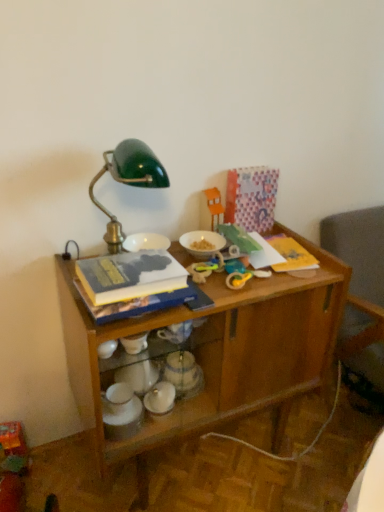
Identify the location of orange plastic toy at upper center, the 1th toy in the top-to-bottom sequence. The width and height of the screenshot is (384, 512). (214, 207).

What do you see at coordinates (202, 243) in the screenshot? I see `white matte bowl at center, the 3th tableware from the bottom` at bounding box center [202, 243].

Identify the location of white glossy bowls at lower center, the first tableware viewed from the left. (121, 412).

Is wooden desk at center far away from white matte bowl at center, the 3th tableware from the bottom?

No, there isn't a large distance between wooden desk at center and white matte bowl at center, the 3th tableware from the bottom.

In the scene shown: Between wooden desk at center and white matte bowl at center, the 3th tableware from the bottom, which one has smaller size?

Smaller between the two is white matte bowl at center, the 3th tableware from the bottom.

In the scene shown: How many degrees apart are the facing directions of wooden desk at center and white matte bowl at center, positioned as the first tableware in right-to-left order?

0.000897 degrees.

Is wooden desk at center wider or thinner than white matte bowl at center, the 3th tableware from the bottom?

In the image, wooden desk at center appears to be wider than white matte bowl at center, the 3th tableware from the bottom.

Locate an element on the screen. the 1st toy to the right of the hardcover book at center, starting your count from the anchor is located at coordinates (206, 268).

Is rubber yellow toy at center, which appears as the 2th toy when ordered from the bottom, turned away from hardcover book at center?

rubber yellow toy at center, which appears as the 2th toy when ordered from the bottom, is not turned away from hardcover book at center.

What's the angular difference between rubber yellow toy at center, which is the 2th toy from front to back, and hardcover book at center's facing directions?

They differ by 0.423 degrees in their facing directions.

Between rubber yellow toy at center, which appears as the 2th toy when ordered from the bottom, and hardcover book at center, which one has more height?

hardcover book at center is taller.

Considering the positions of objects rubber yellow toy at center, which is the 2th toy from front to back, and white matte bowl at center, the 3th tableware from the bottom, in the image provided, who is in front, rubber yellow toy at center, which is the 2th toy from front to back, or white matte bowl at center, the 3th tableware from the bottom,?

Positioned in front is rubber yellow toy at center, which is the 2th toy from front to back.

In the scene shown: Considering the relative sizes of rubber yellow toy at center, which is the 2th toy from front to back, and white matte bowl at center, the 3th tableware from the bottom, in the image provided, is rubber yellow toy at center, which is the 2th toy from front to back, taller than white matte bowl at center, the 3th tableware from the bottom,?

Indeed, rubber yellow toy at center, which is the 2th toy from front to back, has a greater height compared to white matte bowl at center, the 3th tableware from the bottom.

Is rubber yellow toy at center, acting as the second toy starting from the back, not within white matte bowl at center, marked as the third tableware in a left-to-right arrangement?

Yes.

From the image's perspective, would you say rubber yellow toy at center, acting as the second toy starting from the back, is shown under white matte bowl at center, marked as the third tableware in a left-to-right arrangement?

Indeed, from the image's perspective, rubber yellow toy at center, acting as the second toy starting from the back, is shown beneath white matte bowl at center, marked as the third tableware in a left-to-right arrangement.

Could you measure the distance between orange plastic toy at upper center, the 1th toy viewed from the back, and metallic silver teapot at center, placed as the 2th tableware when sorted from top to bottom?

They are 23.70 inches apart.

Between orange plastic toy at upper center, the 1th toy in the top-to-bottom sequence, and metallic silver teapot at center, placed as the 2th tableware when sorted from top to bottom, which one has smaller size?

With smaller size is metallic silver teapot at center, placed as the 2th tableware when sorted from top to bottom.

Between point (214, 197) and point (157, 385), which one is positioned in front?

The point (157, 385) is closer to the camera.

Considering the positions of objects orange plastic toy at upper center, the 1th toy in the top-to-bottom sequence, and metallic silver teapot at center, placed as the 2th tableware when sorted from top to bottom, in the image provided, who is more to the left, orange plastic toy at upper center, the 1th toy in the top-to-bottom sequence, or metallic silver teapot at center, placed as the 2th tableware when sorted from top to bottom,?

metallic silver teapot at center, placed as the 2th tableware when sorted from top to bottom, is more to the left.

You are a GUI agent. You are given a task and a screenshot of the screen. Output one action in this format:
    pyautogui.click(x=<x>, y=<y>)
    Task: Click on the toy in front of the rubber yellow toy at center, which appears as the 2th toy when ordered from the bottom
    
    Given the screenshot: What is the action you would take?
    pyautogui.click(x=241, y=274)

Is rubber yellow toy at center, which is the 2th toy from front to back, at the right side of yellow rubber toy at center, arranged as the 1th toy when viewed from the front?

No, rubber yellow toy at center, which is the 2th toy from front to back, is not to the right of yellow rubber toy at center, arranged as the 1th toy when viewed from the front.

Is rubber yellow toy at center, the second toy in the top-to-bottom sequence, wider than yellow rubber toy at center, the third toy in the top-to-bottom sequence?

Indeed, rubber yellow toy at center, the second toy in the top-to-bottom sequence, has a greater width compared to yellow rubber toy at center, the third toy in the top-to-bottom sequence.

Considering the sizes of rubber yellow toy at center, acting as the second toy starting from the back, and yellow rubber toy at center, which appears as the 1th toy when ordered from the bottom, in the image, is rubber yellow toy at center, acting as the second toy starting from the back, bigger or smaller than yellow rubber toy at center, which appears as the 1th toy when ordered from the bottom,?

In the image, rubber yellow toy at center, acting as the second toy starting from the back, appears to be larger than yellow rubber toy at center, which appears as the 1th toy when ordered from the bottom.

From the image's perspective, between yellow rubber toy at center, acting as the 3th toy starting from the back, and metallic silver teapot at center, which is the second tableware from bottom to top, who is located below?

metallic silver teapot at center, which is the second tableware from bottom to top, is shown below in the image.

Can you confirm if yellow rubber toy at center, acting as the 3th toy starting from the back, is taller than metallic silver teapot at center, which is the second tableware from bottom to top?

Incorrect, the height of yellow rubber toy at center, acting as the 3th toy starting from the back, is not larger of that of metallic silver teapot at center, which is the second tableware from bottom to top.

Can you confirm if yellow rubber toy at center, acting as the 3th toy starting from the back, is bigger than metallic silver teapot at center, placed as the 2th tableware when sorted from top to bottom?

No, yellow rubber toy at center, acting as the 3th toy starting from the back, is not bigger than metallic silver teapot at center, placed as the 2th tableware when sorted from top to bottom.

Is metallic silver teapot at center, which is the second tableware from bottom to top, located within yellow rubber toy at center, arranged as the 1th toy when viewed from the front?

No, metallic silver teapot at center, which is the second tableware from bottom to top, is not surrounded by yellow rubber toy at center, arranged as the 1th toy when viewed from the front.

From the image's perspective, is white glossy bowls at lower center, the first tableware viewed from the left, located above hardcover book at center?

No, from the image's perspective, white glossy bowls at lower center, the first tableware viewed from the left, is not above hardcover book at center.

Looking at this image, is white glossy bowls at lower center, positioned as the 1th tableware in bottom-to-top order, inside the boundaries of hardcover book at center, or outside?

white glossy bowls at lower center, positioned as the 1th tableware in bottom-to-top order, exists outside the volume of hardcover book at center.

Can you confirm if white glossy bowls at lower center, positioned as the 1th tableware in bottom-to-top order, is thinner than hardcover book at center?

Yes, white glossy bowls at lower center, positioned as the 1th tableware in bottom-to-top order, is thinner than hardcover book at center.

What are the coordinates of `the 3rd tableware directly beneath the hardcover book at center (from a real-world perspective)` in the screenshot? It's located at (121, 412).

Find the location of a particular element. The height and width of the screenshot is (512, 384). desk directly beneath the white matte bowl at center, the 3th tableware from the bottom (from a real-world perspective) is located at coordinates (217, 355).

Where is `paperback book lying on the left of rubber yellow toy at center, which is the 2th toy from front to back`? Image resolution: width=384 pixels, height=512 pixels. paperback book lying on the left of rubber yellow toy at center, which is the 2th toy from front to back is located at coordinates (130, 276).

Based on their spatial positions, is white glossy bowls at lower center, which is the 3th tableware from right to left, or rubber yellow toy at center, which appears as the 2th toy when ordered from the bottom, closer to yellow rubber toy at center, arranged as the 1th toy when viewed from the front?

rubber yellow toy at center, which appears as the 2th toy when ordered from the bottom, lies closer to yellow rubber toy at center, arranged as the 1th toy when viewed from the front, than the other object.

Estimate the real-world distances between objects in this image. Which object is further from white matte bowl at center, the 3th tableware from the bottom, rubber yellow toy at center, which is the 2th toy from front to back, or yellow rubber toy at center, which appears as the 1th toy when ordered from the bottom?

Based on the image, yellow rubber toy at center, which appears as the 1th toy when ordered from the bottom, appears to be further to white matte bowl at center, the 3th tableware from the bottom.

Looking at the image, which one is located further to rubber yellow toy at center, the second toy in the top-to-bottom sequence, white matte bowl at center, marked as the third tableware in a left-to-right arrangement, or metallic silver teapot at center, positioned as the second tableware in left-to-right order?

metallic silver teapot at center, positioned as the second tableware in left-to-right order, is further to rubber yellow toy at center, the second toy in the top-to-bottom sequence.

Estimate the real-world distances between objects in this image. Which object is closer to rubber yellow toy at center, acting as the second toy starting from the back, yellow rubber toy at center, which appears as the 1th toy when ordered from the bottom, or white matte bowl at center, positioned as the first tableware in right-to-left order?

The object closer to rubber yellow toy at center, acting as the second toy starting from the back, is yellow rubber toy at center, which appears as the 1th toy when ordered from the bottom.

Looking at the image, which one is located further to wooden desk at center, rubber yellow toy at center, the second toy in the top-to-bottom sequence, or white matte bowl at center, positioned as the first tableware in right-to-left order?

white matte bowl at center, positioned as the first tableware in right-to-left order, lies further to wooden desk at center than the other object.

Estimate the real-world distances between objects in this image. Which object is closer to wooden desk at center, orange plastic toy at upper center, which is the third toy in bottom-to-top order, or rubber yellow toy at center, which appears as the 2th toy when ordered from the bottom?

rubber yellow toy at center, which appears as the 2th toy when ordered from the bottom, is positioned closer to the anchor wooden desk at center.

Based on their spatial positions, is yellow rubber toy at center, acting as the 3th toy starting from the back, or metallic silver teapot at center, positioned as the second tableware in left-to-right order, further from wooden desk at center?

Based on the image, metallic silver teapot at center, positioned as the second tableware in left-to-right order, appears to be further to wooden desk at center.

From the image, which object appears to be nearer to white glossy bowls at lower center, which is the 3th tableware from right to left, rubber yellow toy at center, which appears as the 2th toy when ordered from the bottom, or yellow rubber toy at center, which appears as the 1th toy when ordered from the bottom?

rubber yellow toy at center, which appears as the 2th toy when ordered from the bottom, lies closer to white glossy bowls at lower center, which is the 3th tableware from right to left, than the other object.

The height and width of the screenshot is (512, 384). I want to click on desk between white matte bowl at center, acting as the 1th tableware starting from the top, and white glossy bowls at lower center, the first tableware viewed from the left, vertically, so click(x=217, y=355).

You are a GUI agent. You are given a task and a screenshot of the screen. Output one action in this format:
    pyautogui.click(x=<x>, y=<y>)
    Task: Click on the desk located between hardcover book at center and orange plastic toy at upper center, the 1th toy in the top-to-bottom sequence, in the depth direction
    
    Given the screenshot: What is the action you would take?
    pyautogui.click(x=217, y=355)

Locate an element on the screen. Image resolution: width=384 pixels, height=512 pixels. tableware between yellow rubber toy at center, the third toy in the top-to-bottom sequence, and white glossy bowls at lower center, which is the 3th tableware from right to left, vertically is located at coordinates (160, 398).

Locate an element on the screen. The image size is (384, 512). desk that lies between hardcover book at center and metallic silver teapot at center, the second tableware viewed from the right, from top to bottom is located at coordinates (217, 355).